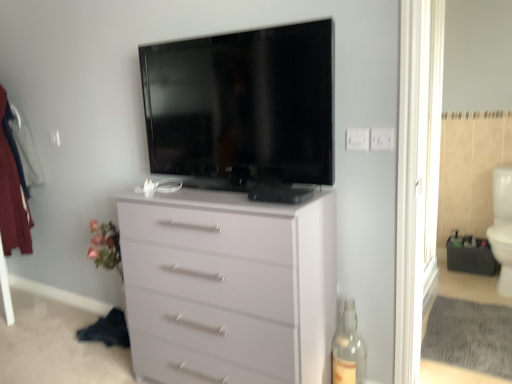
Based on the photo, what is the approximate height of transparent glass door at right?

The height of transparent glass door at right is 6.21 feet.

Image resolution: width=512 pixels, height=384 pixels. Describe the element at coordinates (229, 287) in the screenshot. I see `white glossy chest of drawers at center` at that location.

In order to face white plastic electric outlet at upper right, which appears as the 2th electric outlet when viewed from the left, should I rotate leftwards or rightwards?

A 16.307 degree turn to the right will do.

The width and height of the screenshot is (512, 384). Identify the location of white glossy toilet bowl at right. (502, 227).

Does point (213, 332) appear closer or farther from the camera than point (388, 143)?

Point (213, 332) is positioned farther from the camera compared to point (388, 143).

Is white glossy chest of drawers at center touching white plastic electric outlet at upper right, which appears as the 2th electric outlet when viewed from the left?

No, white glossy chest of drawers at center is not beside white plastic electric outlet at upper right, which appears as the 2th electric outlet when viewed from the left.

Is white plastic electric outlet at upper right, positioned as the first electric outlet in right-to-left order, inside white glossy chest of drawers at center?

No, white plastic electric outlet at upper right, positioned as the first electric outlet in right-to-left order, is not surrounded by white glossy chest of drawers at center.

Considering the sizes of objects white glossy chest of drawers at center and white glossy toilet bowl at right in the image provided, who is bigger, white glossy chest of drawers at center or white glossy toilet bowl at right?

white glossy chest of drawers at center.

Choose the correct answer: Is white glossy chest of drawers at center inside white glossy toilet bowl at right or outside it?

white glossy chest of drawers at center lies outside white glossy toilet bowl at right.

Does white glossy chest of drawers at center have a greater width compared to white glossy toilet bowl at right?

In fact, white glossy chest of drawers at center might be narrower than white glossy toilet bowl at right.

Based on the photo, is white glossy chest of drawers at center taller or shorter than white glossy toilet bowl at right?

Considering their sizes, white glossy chest of drawers at center has more height than white glossy toilet bowl at right.

Looking at this image, does white glossy toilet bowl at right come in front of white plastic electric outlet at upper right, which ranks as the second electric outlet in right-to-left order?

No, white glossy toilet bowl at right is behind white plastic electric outlet at upper right, which ranks as the second electric outlet in right-to-left order.

Considering the sizes of objects white glossy toilet bowl at right and white plastic electric outlet at upper right, which ranks as the second electric outlet in right-to-left order, in the image provided, who is taller, white glossy toilet bowl at right or white plastic electric outlet at upper right, which ranks as the second electric outlet in right-to-left order,?

white glossy toilet bowl at right.

Considering the sizes of objects white glossy toilet bowl at right and white plastic electric outlet at upper right, which ranks as the second electric outlet in right-to-left order, in the image provided, who is smaller, white glossy toilet bowl at right or white plastic electric outlet at upper right, which ranks as the second electric outlet in right-to-left order,?

Smaller between the two is white plastic electric outlet at upper right, which ranks as the second electric outlet in right-to-left order.

From a real-world perspective, relative to white plastic electric outlet at upper right, which ranks as the second electric outlet in right-to-left order, is white glossy toilet bowl at right vertically above or below?

white glossy toilet bowl at right is situated lower than white plastic electric outlet at upper right, which ranks as the second electric outlet in right-to-left order, in the real world.

Considering the sizes of objects white plastic electric outlet at upper right, positioned as the first electric outlet in right-to-left order, and transparent glass bottle at lower right in the image provided, who is wider, white plastic electric outlet at upper right, positioned as the first electric outlet in right-to-left order, or transparent glass bottle at lower right?

Wider between the two is transparent glass bottle at lower right.

Is the depth of white plastic electric outlet at upper right, positioned as the first electric outlet in right-to-left order, greater than that of transparent glass bottle at lower right?

No, it is in front of transparent glass bottle at lower right.

Is white plastic electric outlet at upper right, positioned as the first electric outlet in right-to-left order, bigger than transparent glass bottle at lower right?

No, white plastic electric outlet at upper right, positioned as the first electric outlet in right-to-left order, is not bigger than transparent glass bottle at lower right.

Which object is positioned more to the right, white plastic electric outlet at upper right, positioned as the first electric outlet in right-to-left order, or transparent glass bottle at lower right?

Positioned to the right is white plastic electric outlet at upper right, positioned as the first electric outlet in right-to-left order.

Can you confirm if white glossy toilet bowl at right is bigger than white glossy chest of drawers at center?

No, white glossy toilet bowl at right is not bigger than white glossy chest of drawers at center.

From the image's perspective, between white glossy toilet bowl at right and white glossy chest of drawers at center, which one is located above?

white glossy toilet bowl at right, from the image's perspective.

Between point (511, 171) and point (283, 325), which one is positioned behind?

The point (511, 171) is farther.

Can we say white glossy toilet bowl at right lies outside white glossy chest of drawers at center?

Indeed, white glossy toilet bowl at right is completely outside white glossy chest of drawers at center.

Could flat screen tv at upper center be considered to be inside white glossy toilet bowl at right?

No.

Considering the positions of objects white glossy toilet bowl at right and flat screen tv at upper center in the image provided, who is more to the left, white glossy toilet bowl at right or flat screen tv at upper center?

flat screen tv at upper center is more to the left.

From a real-world perspective, is white glossy toilet bowl at right physically located above or below flat screen tv at upper center?

Clearly, from a real-world perspective, white glossy toilet bowl at right is below flat screen tv at upper center.

Is point (370, 149) more distant than point (510, 267)?

No, it is not.

Can you confirm if white plastic electric outlet at upper right, positioned as the first electric outlet in right-to-left order, is bigger than white glossy toilet bowl at right?

No.

From a real-world perspective, between white plastic electric outlet at upper right, which appears as the 2th electric outlet when viewed from the left, and white glossy toilet bowl at right, who is vertically lower?

white glossy toilet bowl at right is physically lower.

Consider the image. Is white plastic electric outlet at upper right, positioned as the first electric outlet in right-to-left order, not near white glossy toilet bowl at right?

Absolutely, white plastic electric outlet at upper right, positioned as the first electric outlet in right-to-left order, is distant from white glossy toilet bowl at right.

This screenshot has width=512, height=384. Identify the location of electric outlet that is the 2nd object above the white glossy chest of drawers at center (from a real-world perspective). (382, 139).

You are a GUI agent. You are given a task and a screenshot of the screen. Output one action in this format:
    pyautogui.click(x=<x>, y=<y>)
    Task: Click on the toilet bowl behind the white glossy chest of drawers at center
    This screenshot has height=384, width=512.
    Given the screenshot: What is the action you would take?
    pyautogui.click(x=502, y=227)

Estimate the real-world distances between objects in this image. Which object is closer to white plastic electric outlet at upper right, which appears as the 2th electric outlet when viewed from the left, flat screen tv at upper center or white glossy chest of drawers at center?

The object closer to white plastic electric outlet at upper right, which appears as the 2th electric outlet when viewed from the left, is flat screen tv at upper center.

Based on the photo, considering their positions, is transparent glass bottle at lower right positioned further to white glossy chest of drawers at center than flat screen tv at upper center?

The object further to white glossy chest of drawers at center is transparent glass bottle at lower right.

Looking at the image, which one is located closer to transparent glass bottle at lower right, white glossy chest of drawers at center or transparent glass door at right?

Among the two, white glossy chest of drawers at center is located nearer to transparent glass bottle at lower right.

Looking at the image, which one is located further to white plastic electric outlet at upper right, positioned as the first electric outlet in right-to-left order, transparent glass door at right or white glossy toilet bowl at right?

white glossy toilet bowl at right is positioned further to the anchor white plastic electric outlet at upper right, positioned as the first electric outlet in right-to-left order.

Which object lies nearer to the anchor point white glossy chest of drawers at center, transparent glass door at right or flat screen tv at upper center?

flat screen tv at upper center lies closer to white glossy chest of drawers at center than the other object.

Based on their spatial positions, is white glossy toilet bowl at right or transparent glass bottle at lower right further from white plastic electric outlet at upper right, which ranks as the second electric outlet in right-to-left order?

The object further to white plastic electric outlet at upper right, which ranks as the second electric outlet in right-to-left order, is white glossy toilet bowl at right.

Estimate the real-world distances between objects in this image. Which object is closer to white plastic electric outlet at upper right, which ranks as the second electric outlet in right-to-left order, transparent glass door at right or flat screen tv at upper center?

Among the two, flat screen tv at upper center is located nearer to white plastic electric outlet at upper right, which ranks as the second electric outlet in right-to-left order.

Consider the image. Based on their spatial positions, is white glossy chest of drawers at center or transparent glass bottle at lower right further from white plastic electric outlet at upper right, positioned as the first electric outlet in right-to-left order?

The object further to white plastic electric outlet at upper right, positioned as the first electric outlet in right-to-left order, is transparent glass bottle at lower right.

Find the location of a particular element. bottle between white glossy chest of drawers at center and transparent glass door at right from left to right is located at coordinates pyautogui.click(x=349, y=350).

Locate an element on the screen. The height and width of the screenshot is (384, 512). electric outlet between white plastic electric outlet at upper right, which ranks as the second electric outlet in right-to-left order, and transparent glass door at right, in the horizontal direction is located at coordinates (382, 139).

The width and height of the screenshot is (512, 384). I want to click on the chest of drawers that lies between white plastic electric outlet at upper right, positioned as the first electric outlet in right-to-left order, and transparent glass bottle at lower right from top to bottom, so (x=229, y=287).

Identify the location of glass door located between white glossy chest of drawers at center and white glossy toilet bowl at right in the left-right direction. The width and height of the screenshot is (512, 384). (417, 176).